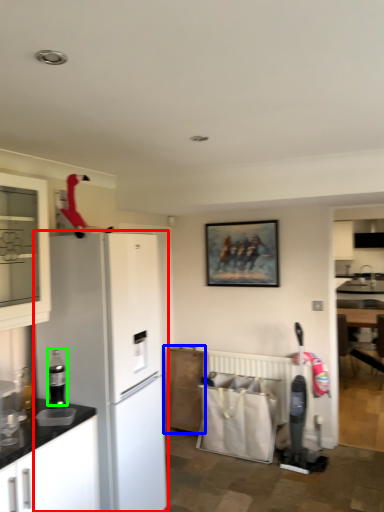
Question: Considering the real-world distances, which object is farthest from refrigerator (highlighted by a red box)? cabinetry (highlighted by a blue box) or appliance (highlighted by a green box)?

Choices:
 (A) cabinetry
 (B) appliance

Answer: (A)